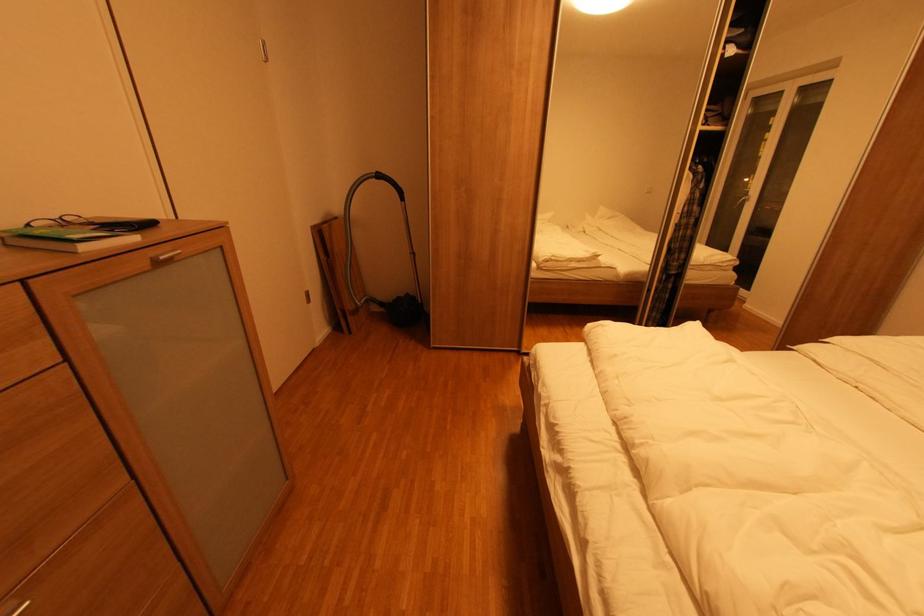
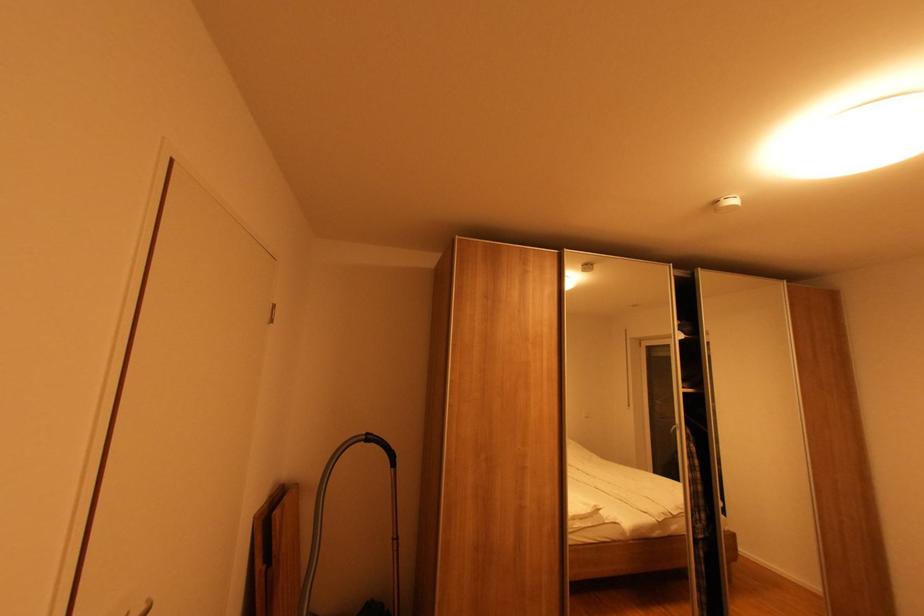
The images are taken continuously from a first-person perspective. In which direction is your viewpoint rotating?

The camera's rotation is toward right-up.